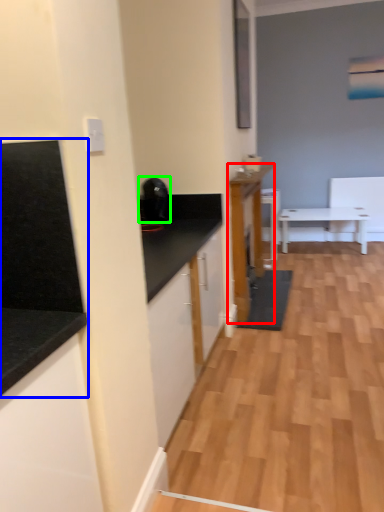
Question: Considering the real-world distances, which object is closest to cabinetry (highlighted by a red box)? countertop (highlighted by a blue box) or appliance (highlighted by a green box).

Choices:
 (A) countertop
 (B) appliance

Answer: (B)